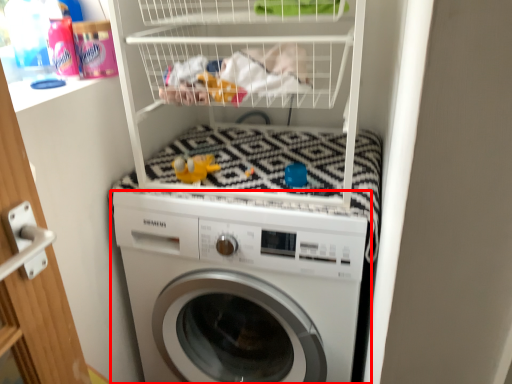
Question: From the image's perspective, what is the correct spatial positioning of washing machine (annotated by the red box) in reference to toy?

Choices:
 (A) above
 (B) below

Answer: (B)